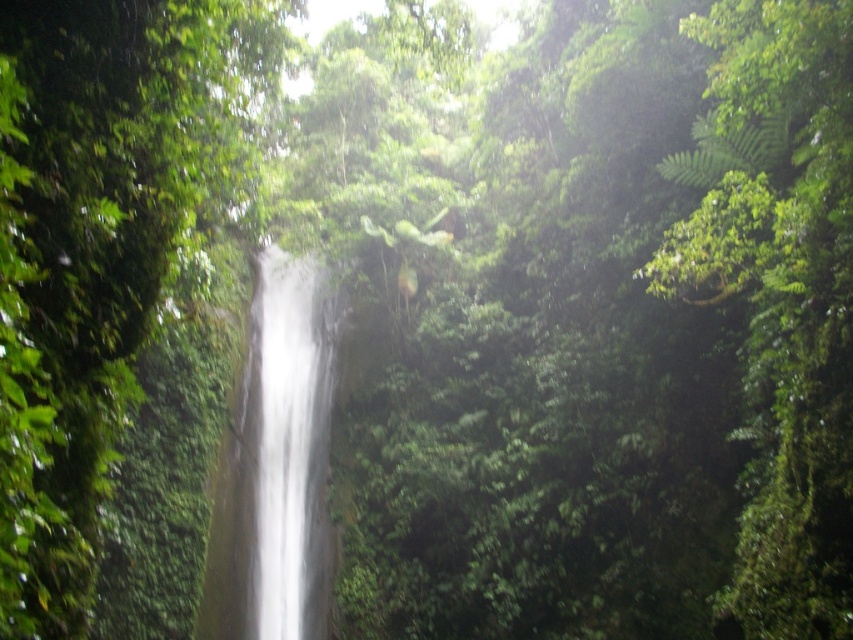
You are a hiker trying to cross the jungle. You see a green leafy tree at right and a white smooth waterfall at center. Which object is wider from your viewpoint?

The green leafy tree at right is wider than the white smooth waterfall at center according to the description.

You are a hiker who wants to take a photo of the white smooth waterfall at center without the green leafy tree at right blocking the view. Which direction should you move to position yourself so the tree is no longer in front of the waterfall?

Move to the left so that the green leafy tree at right is no longer blocking the view of the white smooth waterfall at center. Since the green leafy tree at right is to the right of the waterfall, moving left would shift your perspective away from the tree, allowing a clear view of the waterfall.